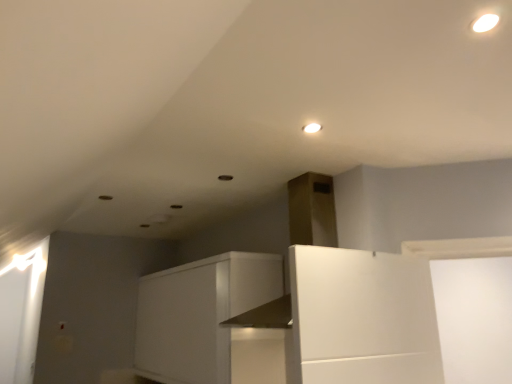
Question: Is white matte cabinet at center bigger or smaller than matte white light fixture at upper center?

Choices:
 (A) small
 (B) big

Answer: (B)

Question: Visually, is white matte cabinet at center positioned to the left or to the right of matte white light fixture at upper center?

Choices:
 (A) left
 (B) right

Answer: (A)

Question: In terms of width, does white matte cabinet at center look wider or thinner when compared to matte white light fixture at upper center?

Choices:
 (A) thin
 (B) wide

Answer: (B)

Question: In the image, is matte white light fixture at upper center positioned in front of or behind white matte cabinet at center?

Choices:
 (A) front
 (B) behind

Answer: (A)

Question: Is point (312, 122) closer or farther from the camera than point (185, 369)?

Choices:
 (A) closer
 (B) farther

Answer: (A)

Question: From a real-world perspective, is matte white light fixture at upper center above or below white matte cabinet at center?

Choices:
 (A) above
 (B) below

Answer: (A)

Question: From the image's perspective, is matte white light fixture at upper center above or below white matte cabinet at center?

Choices:
 (A) below
 (B) above

Answer: (B)